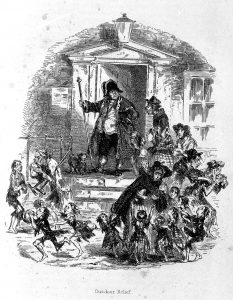
Locate an element on the screen. Image resolution: width=233 pixels, height=300 pixels. entry way is located at coordinates (141, 90).